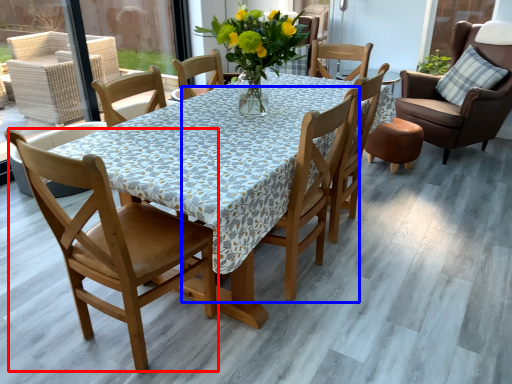
Question: Which of the following is the closest to the observer, chair (highlighted by a red box) or chair (highlighted by a blue box)?

Choices:
 (A) chair
 (B) chair

Answer: (A)